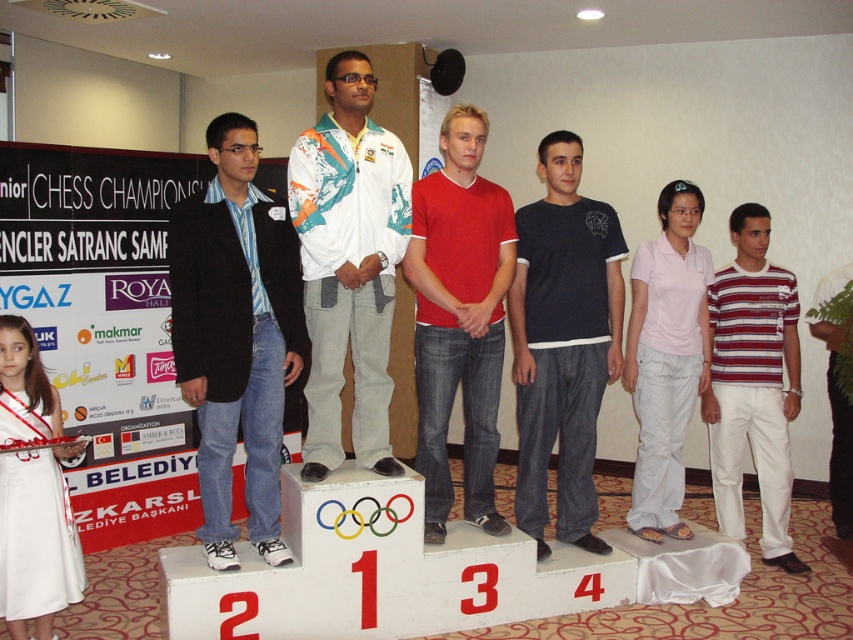
Is red cotton t-shirt at center shorter than striped cotton t-shirt at right?

Yes.

Is red cotton t-shirt at center taller than striped cotton t-shirt at right?

In fact, red cotton t-shirt at center may be shorter than striped cotton t-shirt at right.

Who is more forward, (426, 179) or (788, 365)?

Point (426, 179) is more forward.

Locate an element on the screen. red cotton t-shirt at center is located at coordinates (459, 317).

Does matte black blazer at center appear on the left side of red cotton t-shirt at center?

Yes, matte black blazer at center is to the left of red cotton t-shirt at center.

Who is shorter, matte black blazer at center or red cotton t-shirt at center?

Result: matte black blazer at center is shorter.

The height and width of the screenshot is (640, 853). I want to click on matte black blazer at center, so click(236, 336).

Between matte black blazer at center and white fabric jacket at center, which one has less height?

white fabric jacket at center is shorter.

How much distance is there between matte black blazer at center and white fabric jacket at center?

They are 9.44 inches apart.

The image size is (853, 640). Identify the location of matte black blazer at center. (236, 336).

Find the location of a particular element. Image resolution: width=853 pixels, height=640 pixels. matte black blazer at center is located at coordinates (236, 336).